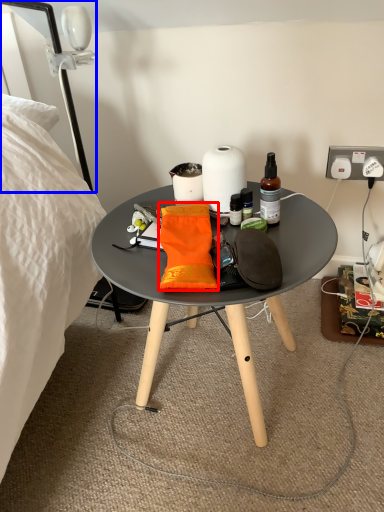
Question: Which point is closer to the camera, material (highlighted by a red box) or lamp (highlighted by a blue box)?

Choices:
 (A) material
 (B) lamp

Answer: (A)